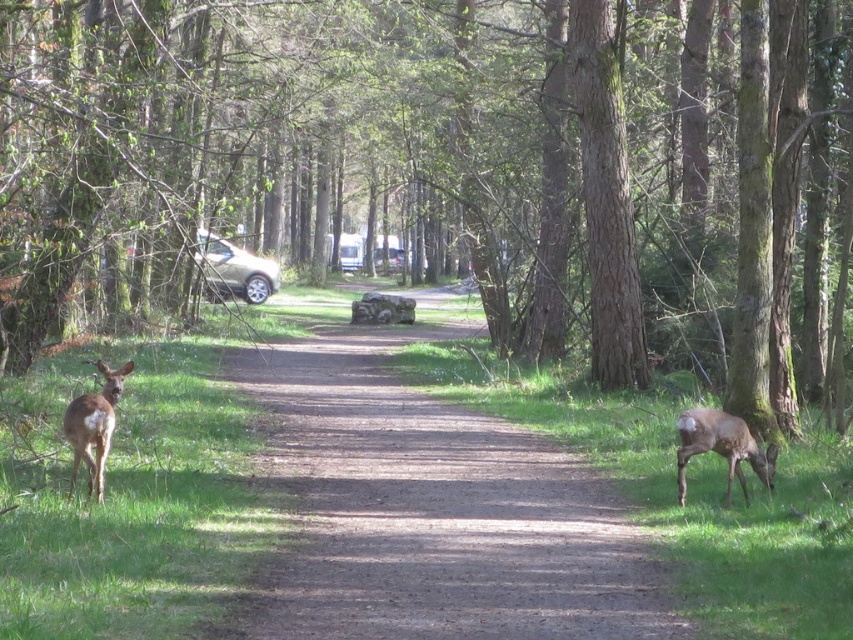
Can you confirm if brown textured tree at center is bigger than dirt path at center?

Yes, brown textured tree at center is bigger than dirt path at center.

Between point (442, 83) and point (368, 413), which one is positioned behind?

The point (442, 83) is behind.

The width and height of the screenshot is (853, 640). I want to click on brown textured tree at center, so click(x=428, y=161).

Between brown furry deer at lower right and beige matte car at center, which one appears on the right side from the viewer's perspective?

Positioned to the right is brown furry deer at lower right.

Does brown furry deer at lower right have a larger size compared to beige matte car at center?

No, brown furry deer at lower right is not bigger than beige matte car at center.

This screenshot has height=640, width=853. What do you see at coordinates (721, 448) in the screenshot?
I see `brown furry deer at lower right` at bounding box center [721, 448].

Find the location of a particular element. brown furry deer at lower right is located at coordinates (721, 448).

At what (x,y) coordinates should I click in order to perform the action: click on dirt path at center. Please return your answer as a coordinate pair (x, y). This screenshot has width=853, height=640. Looking at the image, I should click on (432, 509).

Is point (489, 616) closer to camera compared to point (743, 488)?

Yes, point (489, 616) is in front of point (743, 488).

Where is `dirt path at center`? This screenshot has width=853, height=640. dirt path at center is located at coordinates (432, 509).